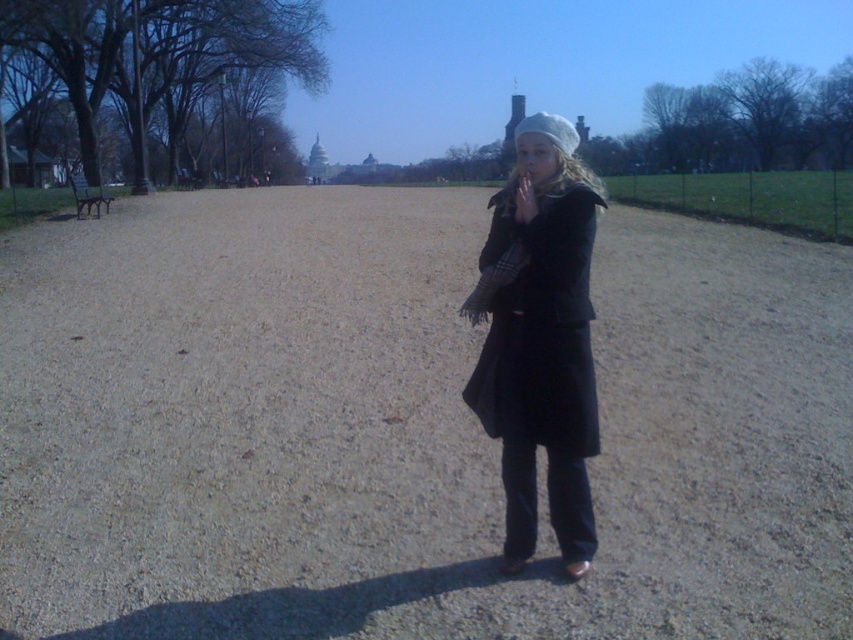
The image size is (853, 640). I want to click on dirt/gravel path at center, so click(x=405, y=428).

Between point (335, 444) and point (527, 202), which one is positioned in front?

Point (527, 202)

Identify the location of dirt/gravel path at center. (405, 428).

Is the position of matte black coat at center less distant than that of matte black hand at center?

No, matte black coat at center is behind matte black hand at center.

Does point (511, 365) come farther from viewer compared to point (529, 220)?

Yes, it is.

Which is in front, point (548, 220) or point (527, 220)?

Positioned in front is point (548, 220).

Where is `matte black coat at center`? This screenshot has height=640, width=853. matte black coat at center is located at coordinates (540, 340).

Which is above, dirt/gravel path at center or matte black coat at center?

dirt/gravel path at center

Is dirt/gravel path at center to the left of matte black coat at center from the viewer's perspective?

Correct, you'll find dirt/gravel path at center to the left of matte black coat at center.

Is point (9, 320) more distant than point (560, 449)?

Yes.

At what (x,y) coordinates should I click in order to perform the action: click on dirt/gravel path at center. Please return your answer as a coordinate pair (x, y). The height and width of the screenshot is (640, 853). Looking at the image, I should click on (405, 428).